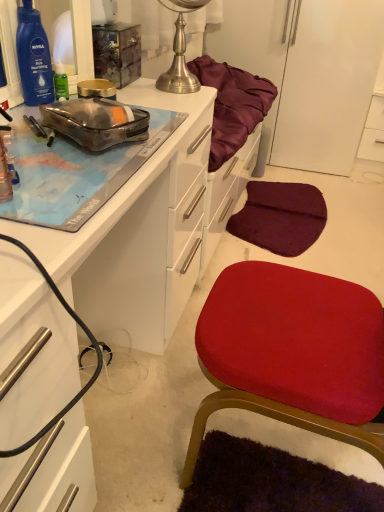
Question: Should I look upward or downward to see transparent plastic pouch at upper left?

Choices:
 (A) up
 (B) down

Answer: (A)

Question: Does velvet red cushion at center have a smaller size compared to brushed metal globe at upper center?

Choices:
 (A) no
 (B) yes

Answer: (A)

Question: Is velvet red cushion at center located outside brushed metal globe at upper center?

Choices:
 (A) no
 (B) yes

Answer: (B)

Question: Can you confirm if velvet red cushion at center is taller than brushed metal globe at upper center?

Choices:
 (A) no
 (B) yes

Answer: (B)

Question: Does velvet red cushion at center have a lesser height compared to brushed metal globe at upper center?

Choices:
 (A) yes
 (B) no

Answer: (B)

Question: From the image's perspective, would you say velvet red cushion at center is shown under brushed metal globe at upper center?

Choices:
 (A) no
 (B) yes

Answer: (B)

Question: From a real-world perspective, is velvet red cushion at center on top of brushed metal globe at upper center?

Choices:
 (A) yes
 (B) no

Answer: (B)

Question: Does brushed metal globe at upper center have a larger size compared to transparent plastic pouch at upper left?

Choices:
 (A) yes
 (B) no

Answer: (A)

Question: Can transparent plastic pouch at upper left be found inside brushed metal globe at upper center?

Choices:
 (A) no
 (B) yes

Answer: (A)

Question: From a real-world perspective, is brushed metal globe at upper center located beneath transparent plastic pouch at upper left?

Choices:
 (A) yes
 (B) no

Answer: (B)

Question: Considering the relative sizes of brushed metal globe at upper center and transparent plastic pouch at upper left in the image provided, is brushed metal globe at upper center taller than transparent plastic pouch at upper left?

Choices:
 (A) no
 (B) yes

Answer: (B)

Question: Is the depth of brushed metal globe at upper center less than that of transparent plastic pouch at upper left?

Choices:
 (A) yes
 (B) no

Answer: (B)

Question: Is brushed metal globe at upper center at the right side of transparent plastic pouch at upper left?

Choices:
 (A) no
 (B) yes

Answer: (B)

Question: Would you say white glossy cabinet at upper right, which is counted as the 2th cabinetry, starting from the bottom, is outside matte white desk at upper left, the first cabinetry from the left?

Choices:
 (A) no
 (B) yes

Answer: (B)